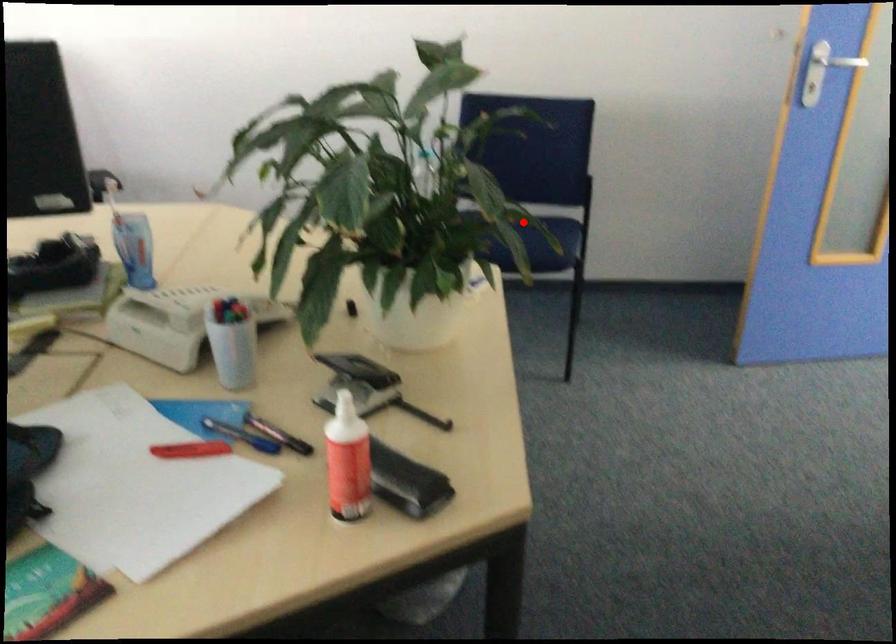
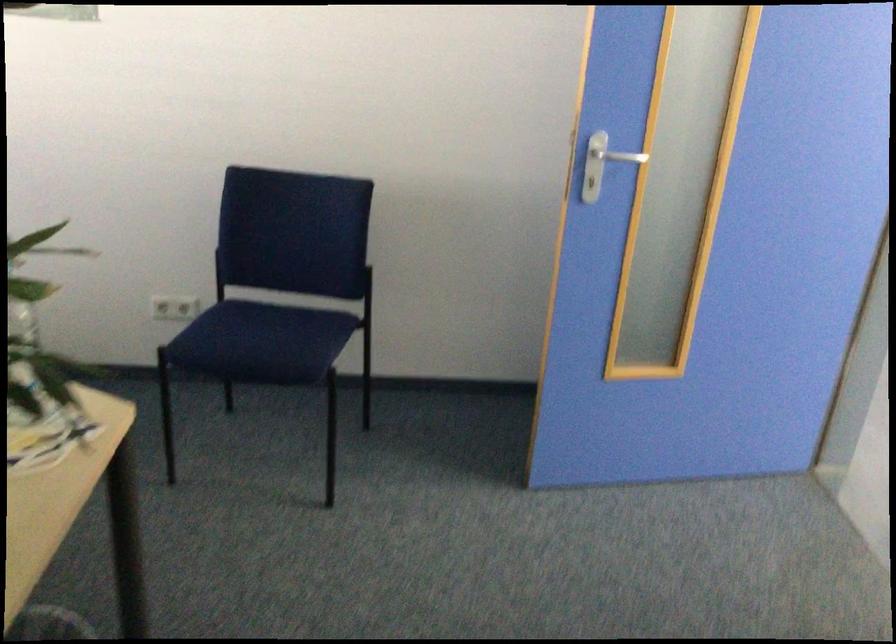
The point at the highlighted location is marked in the first image. Where is the corresponding point in the second image?

(271, 328)